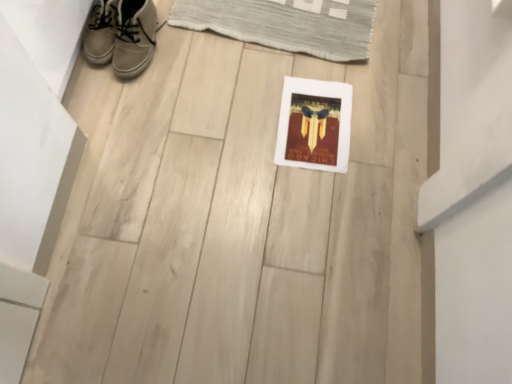
Locate an element on the screen. Image resolution: width=512 pixels, height=384 pixels. free region under white matte picture frame at center (from a real-world perspective) is located at coordinates (315, 125).